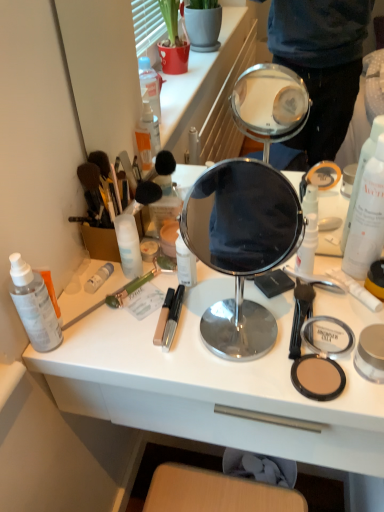
This screenshot has height=512, width=384. I want to click on vacant space to the left of polished silver mirror at center, so click(x=130, y=333).